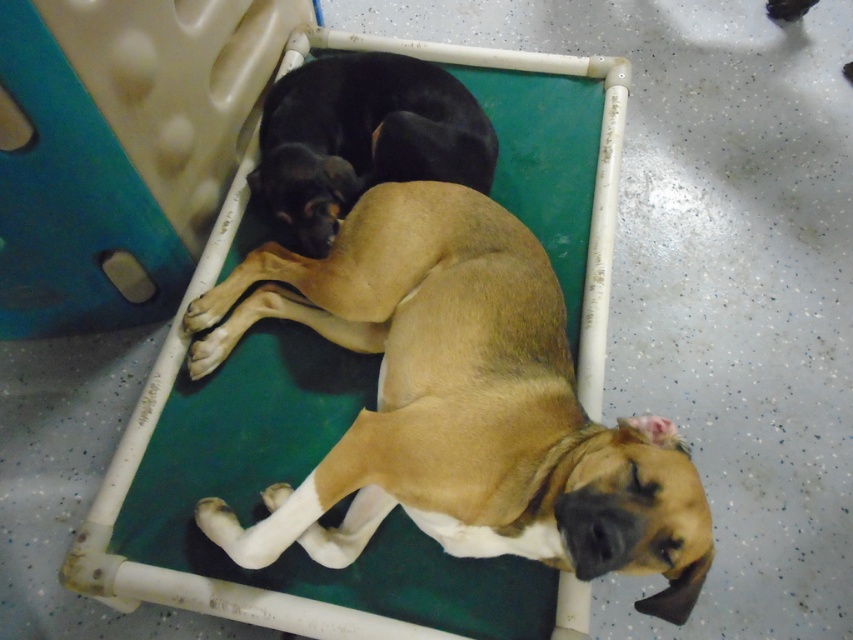
Question: Does brown smooth dog at center appear under black fur dog at center?

Choices:
 (A) yes
 (B) no

Answer: (A)

Question: In this image, where is brown smooth dog at center located relative to black fur dog at center?

Choices:
 (A) below
 (B) above

Answer: (A)

Question: Can you confirm if brown smooth dog at center is positioned to the left of black fur dog at center?

Choices:
 (A) yes
 (B) no

Answer: (B)

Question: Which object is closer to the camera taking this photo?

Choices:
 (A) black fur dog at center
 (B) brown smooth dog at center

Answer: (B)